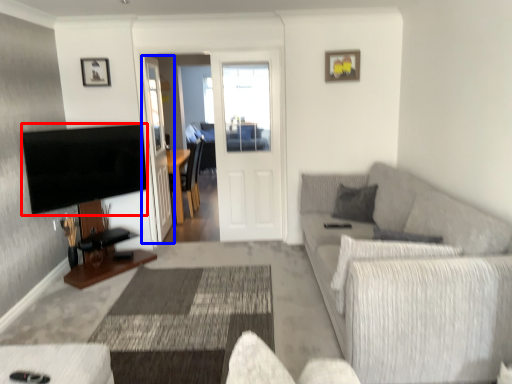
Question: Which point is further to the camera, television (highlighted by a red box) or glass door (highlighted by a blue box)?

Choices:
 (A) television
 (B) glass door

Answer: (B)